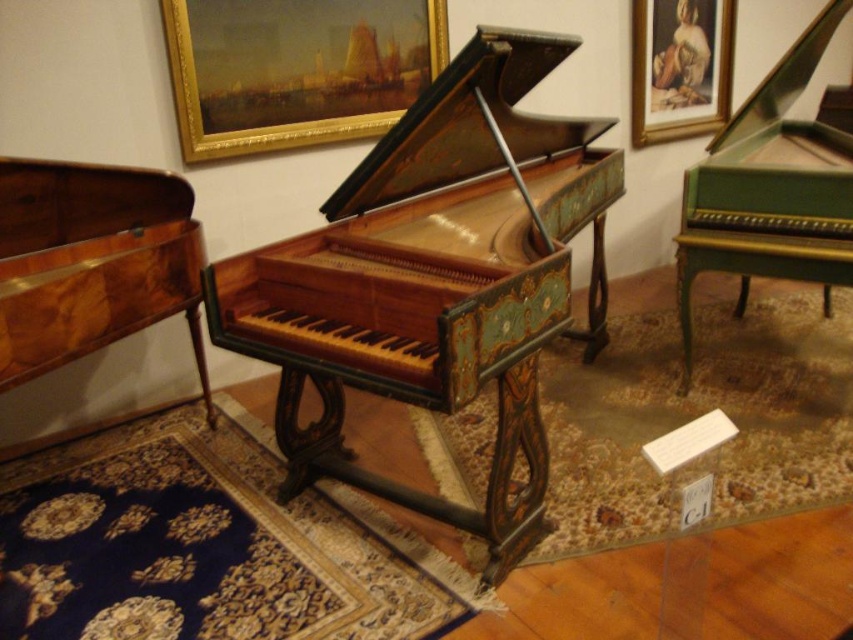
You are a museum curator planning to move the wooden piano at center and the green polished wood harpsichord at right to a new exhibition hall. The entrance to the hall has a doorway that is 1.5 meters wide. Can both instruments fit through the doorway if moved one at a time?

The wooden piano at center is bigger than the green polished wood harpsichord at right. Since the doorway is 1.5 meters wide, we need to check the width of each instrument. However, the exact dimensions are not provided. Therefore, it is uncertain if both can fit through the doorway without more information about their specific widths.

You are a museum visitor standing in front of the wooden piano at center and the matte gold picture frame at upper right. Which object is located to the right of the other?

The wooden piano at center is positioned on the left side of matte gold picture frame at upper right, so the matte gold picture frame at upper right is to the right of the wooden piano at center.